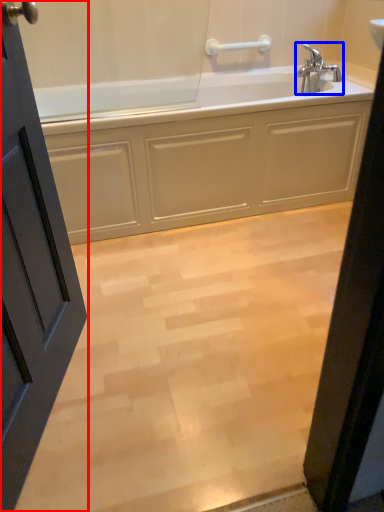
Question: Which object is further to the camera taking this photo, door (highlighted by a red box) or tap (highlighted by a blue box)?

Choices:
 (A) door
 (B) tap

Answer: (B)